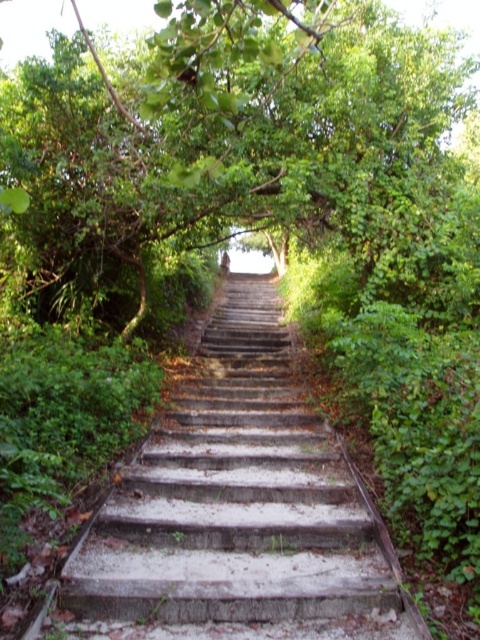
Between point (124, 580) and point (331, 80), which one is positioned in front?

Point (124, 580) is more forward.

Is concrete stairs at center to the left of green leafy tree at center from the viewer's perspective?

Indeed, concrete stairs at center is positioned on the left side of green leafy tree at center.

Between point (141, 497) and point (384, 44), which one is positioned behind?

The point (384, 44) is more distant.

Where is `concrete stairs at center`? concrete stairs at center is located at coordinates (235, 512).